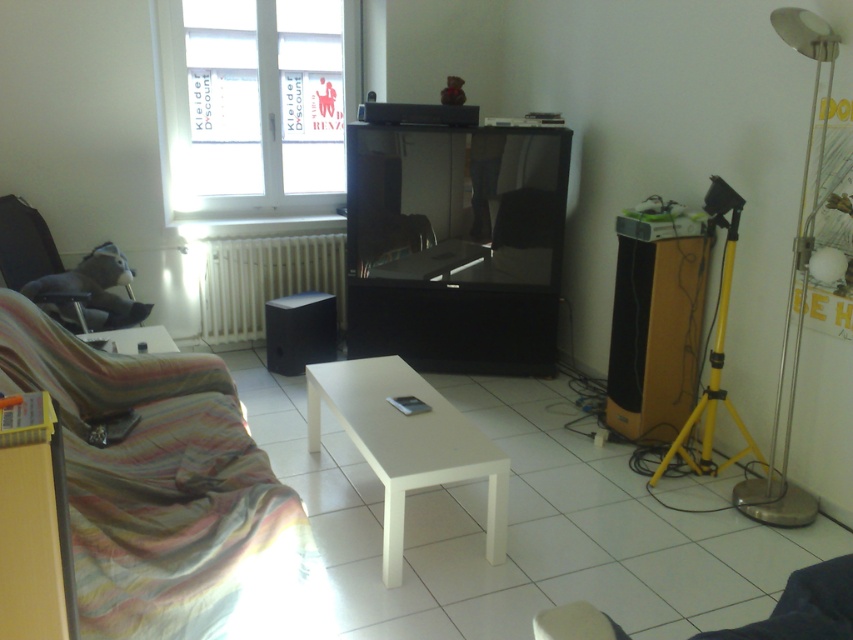
Does white matte radiator at lower left appear on the left side of black matte speaker at lower center?

Yes, white matte radiator at lower left is to the left of black matte speaker at lower center.

Between white matte radiator at lower left and black matte speaker at lower center, which one has more height?

Standing taller between the two is white matte radiator at lower left.

Is point (252, 259) in front of point (283, 305)?

No, (252, 259) is behind (283, 305).

Locate an element on the screen. white matte radiator at lower left is located at coordinates [x=264, y=280].

Is white glossy table at center closer to camera compared to white matte radiator at lower left?

That is True.

Which is behind, point (502, 454) or point (318, 248)?

Point (318, 248)

Find the location of a particular element. The height and width of the screenshot is (640, 853). white glossy table at center is located at coordinates (405, 444).

Who is more distant from viewer, (421, 198) or (90, 321)?

The point (421, 198) is behind.

Who is taller, glossy black tv at center or suede-like black armchair at left?

glossy black tv at center is taller.

Where is `glossy black tv at center`? This screenshot has width=853, height=640. glossy black tv at center is located at coordinates [456, 244].

The image size is (853, 640). What are the coordinates of `glossy black tv at center` in the screenshot? It's located at (456, 244).